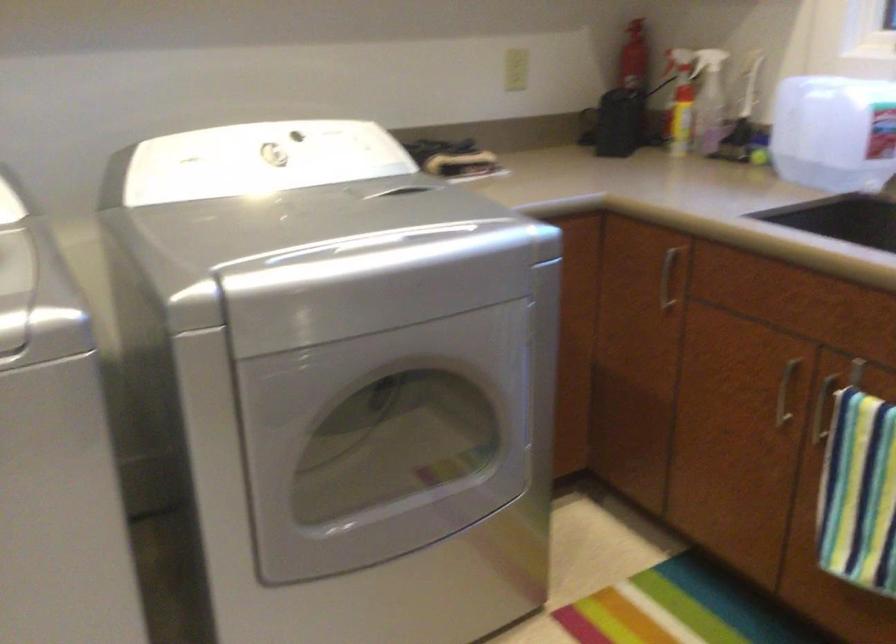
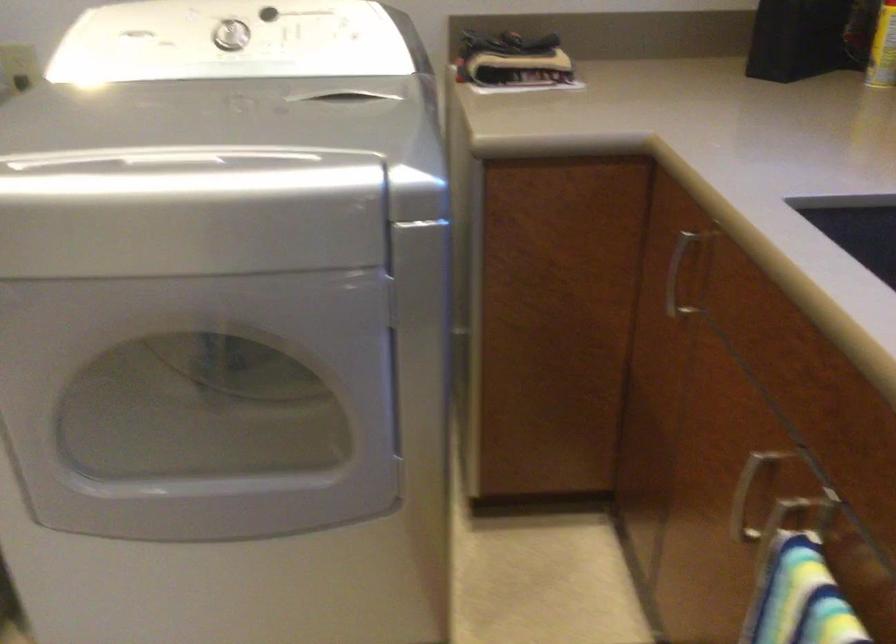
Locate, in the second image, the point that corresponds to pixel 677 128 in the first image.

(883, 49)